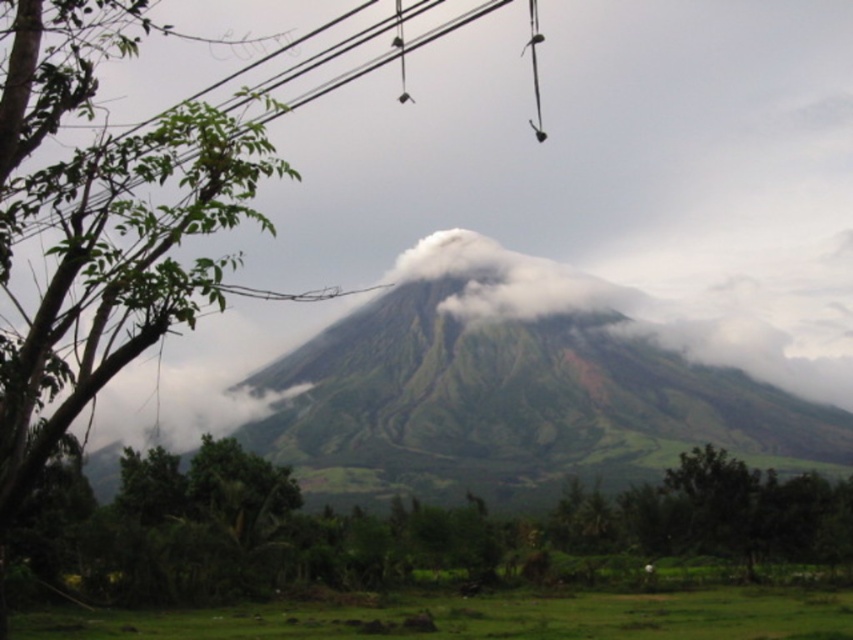
You are a bird flying over the landscape and want to land on the green grassy mountain at center. However, there are power lines nearby. Based on the scene, will the black wire at upper center interfere with your landing?

The black wire at upper center is taller than the green grassy mountain at center, so the wire will interfere with your landing as it is higher up in the sky.

You are standing at the point marked by the coordinates point (102, 227) in the image. Looking towards the large conical mountain in the distance, which direction should you walk to reach the mountain?

The point (102, 227) corresponds to the green leafy tree at left. Since the mountain is in the distance, you should walk towards the direction away from the green leafy tree at left, which is towards the center of the image where the mountain is located.